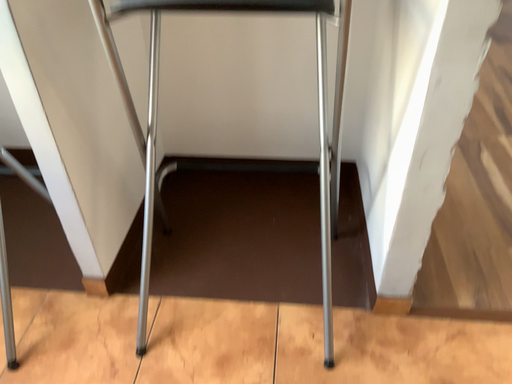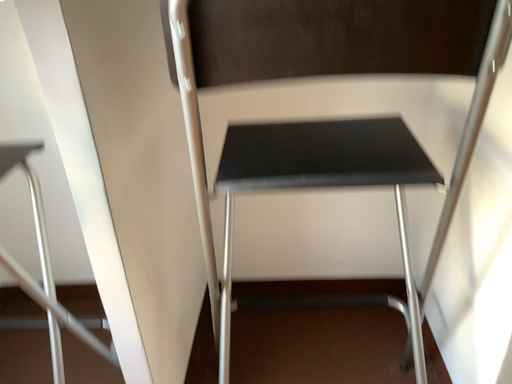
Question: How did the camera likely rotate when shooting the video?

Choices:
 (A) rotated downward
 (B) rotated upward

Answer: (B)